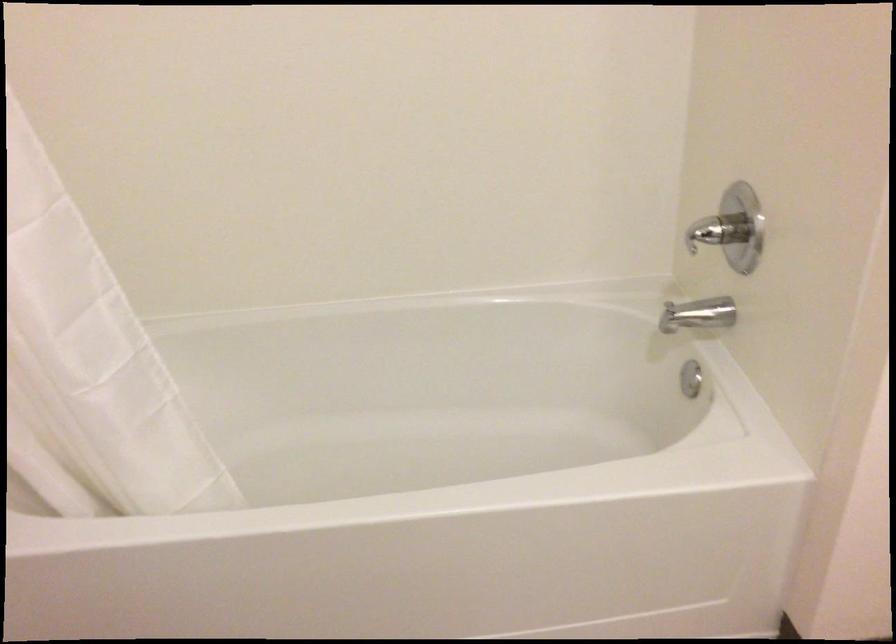
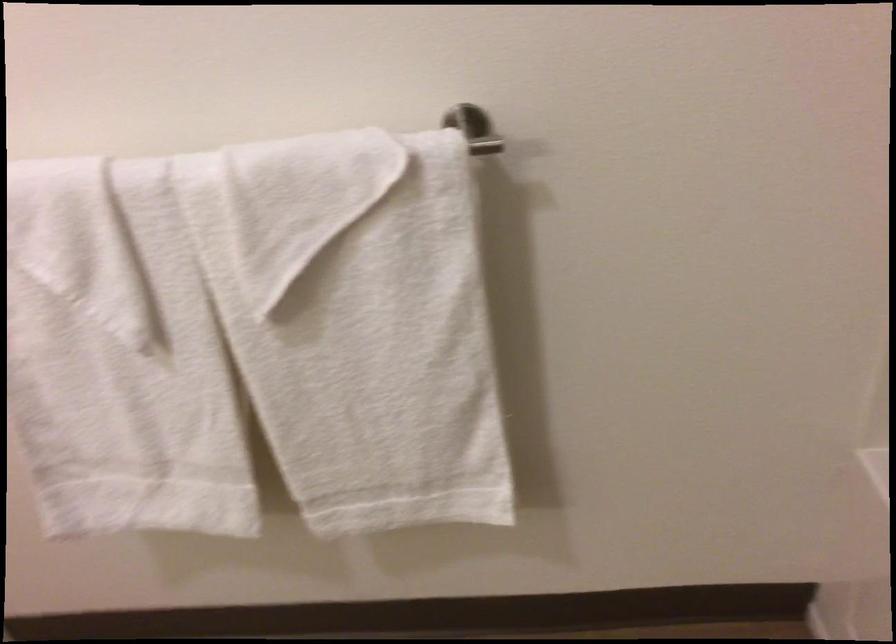
The first image is from the beginning of the video and the second image is from the end. How did the camera likely rotate when shooting the video?

The camera rotated toward left-down.